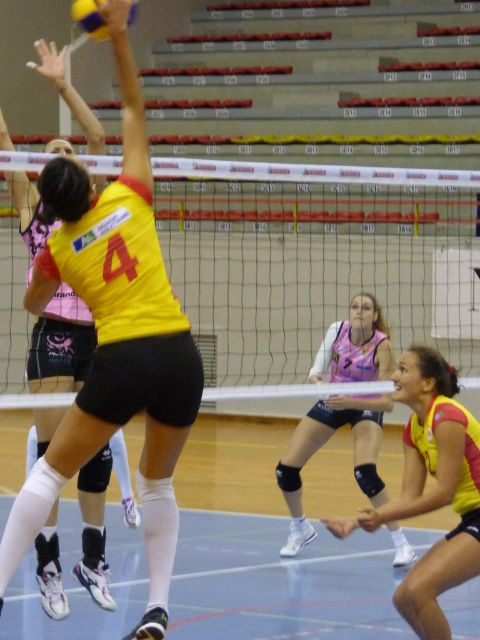
You are a volleyball coach observing the game. You notice the beige mesh net at center and the yellow matte jersey at center. Which object is located higher in the image?

The beige mesh net at center is positioned over the yellow matte jersey at center, so it is higher.

You are a photographer standing in the center of the volleyball court. You want to take a photo of both the point at (303, 522) and the point at (79, 20). Which point will appear closer to the camera in your photo?

Point (79, 20) will appear closer to the camera because it is closer to the viewer than point (303, 522), which is further away.

Based on the photo, you are a volleyball coach analyzing the game from the sidelines. You notice the beige mesh net at center and the yellow matte jersey at lower right. Which object takes up more space in the image?

The beige mesh net at center is larger in size than the yellow matte jersey at lower right, so the beige mesh net at center takes up more space in the image.